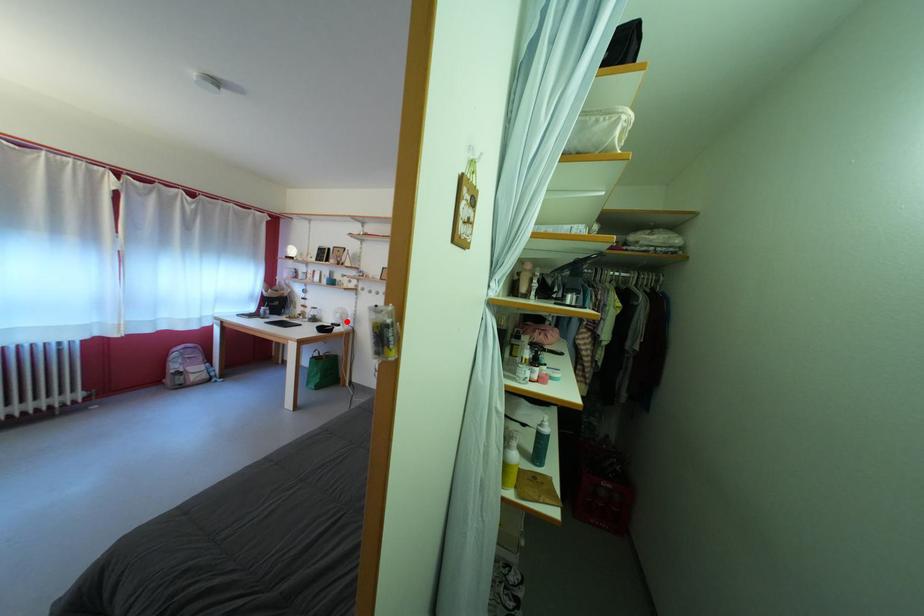
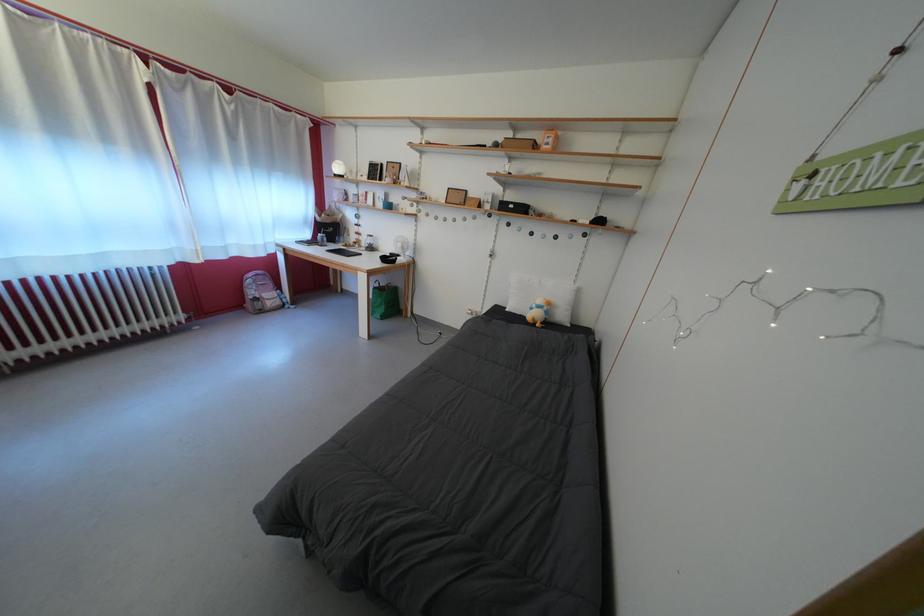
Question: I am providing you with two images of the same scene from different viewpoints. A red point is shown in image1. For the corresponding object point in image2, is it positioned nearer or farther from the camera?

Choices:
 (A) Nearer
 (B) Farther

Answer: (A)